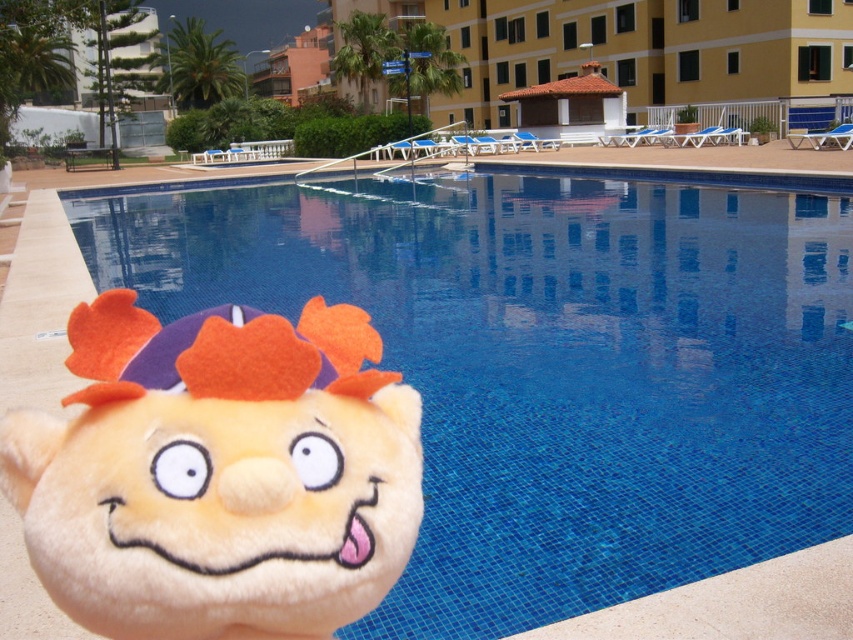
Question: Is blue mosaic tiles at lower left closer to the viewer compared to fluffy beige plush toy at lower left?

Choices:
 (A) yes
 (B) no

Answer: (B)

Question: Which of the following is the farthest from the observer?

Choices:
 (A) fluffy beige plush toy at lower left
 (B) blue mosaic tiles at lower left

Answer: (B)

Question: Can you confirm if blue mosaic tiles at lower left is positioned to the right of fluffy beige plush toy at lower left?

Choices:
 (A) yes
 (B) no

Answer: (A)

Question: Which point is farther to the camera?

Choices:
 (A) fluffy beige plush toy at lower left
 (B) blue mosaic tiles at lower left

Answer: (B)

Question: Which of the following is the closest to the observer?

Choices:
 (A) blue mosaic tiles at lower left
 (B) fluffy beige plush toy at lower left

Answer: (B)

Question: Where is blue mosaic tiles at lower left located in relation to fluffy beige plush toy at lower left in the image?

Choices:
 (A) right
 (B) left

Answer: (A)